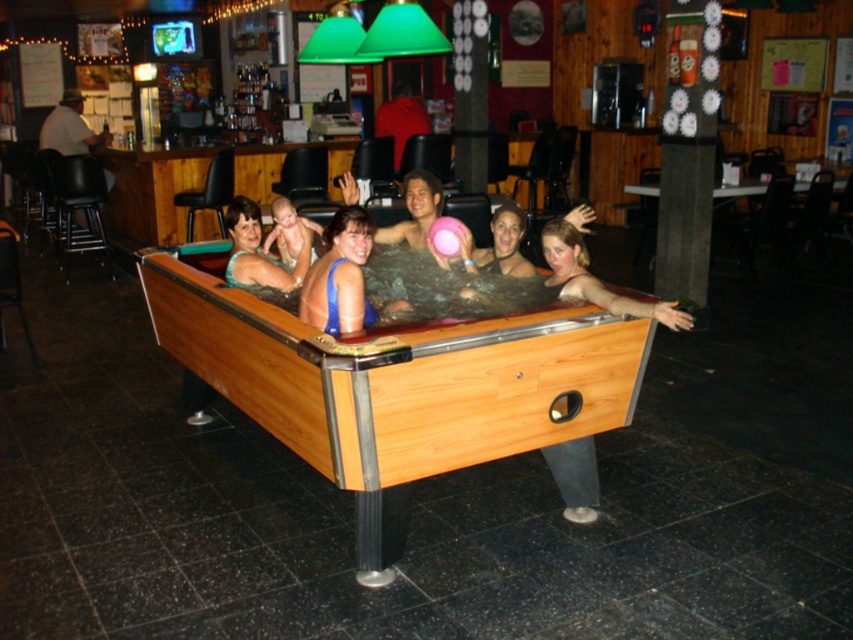
Question: Which of the following is the farthest from the observer?

Choices:
 (A) (360, 560)
 (B) (231, 216)

Answer: (B)

Question: Observing the image, what is the correct spatial positioning of wooden pool table at center in reference to matte blue swimsuit at center?

Choices:
 (A) below
 (B) above

Answer: (A)

Question: In this image, where is wooden pool table at center located relative to matte blue swimsuit at center?

Choices:
 (A) above
 (B) below

Answer: (B)

Question: Is wooden pool table at center above matte blue swimsuit at center?

Choices:
 (A) yes
 (B) no

Answer: (B)